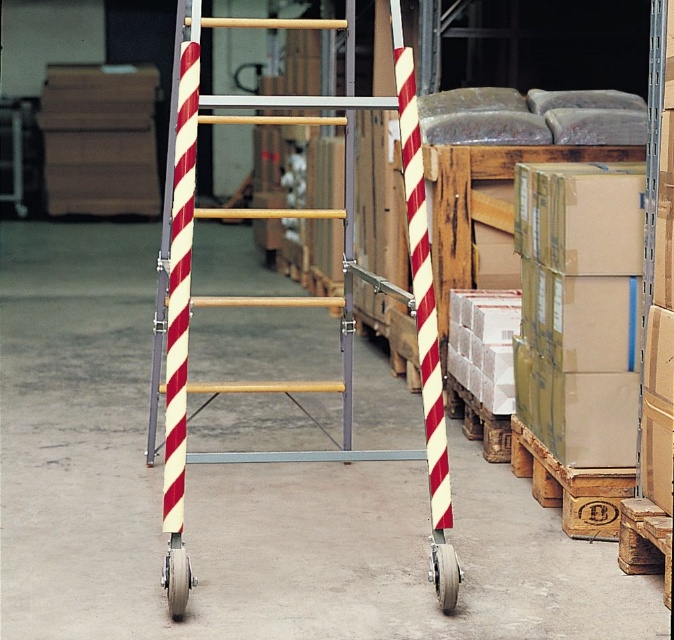
Question: Which point is closer to the camera?

Choices:
 (A) metallic silver ladder at center
 (B) gray rubber wheel at lower center
 (C) red and white striped ladder at center
 (D) gray rubber wheel at lower left

Answer: (D)

Question: Where is metallic silver ladder at center located in relation to gray rubber wheel at lower center in the image?

Choices:
 (A) right
 (B) left

Answer: (B)

Question: Which object is the closest to the gray rubber wheel at lower left?

Choices:
 (A) gray rubber wheel at lower center
 (B) red and white striped ladder at center
 (C) metallic silver ladder at center

Answer: (A)

Question: Can you confirm if metallic silver ladder at center is positioned to the left of gray rubber wheel at lower center?

Choices:
 (A) no
 (B) yes

Answer: (B)

Question: Which of the following is the closest to the observer?

Choices:
 (A) [x=435, y=557]
 (B) [x=173, y=278]

Answer: (A)

Question: Can you confirm if metallic silver ladder at center is positioned above gray rubber wheel at lower center?

Choices:
 (A) no
 (B) yes

Answer: (B)